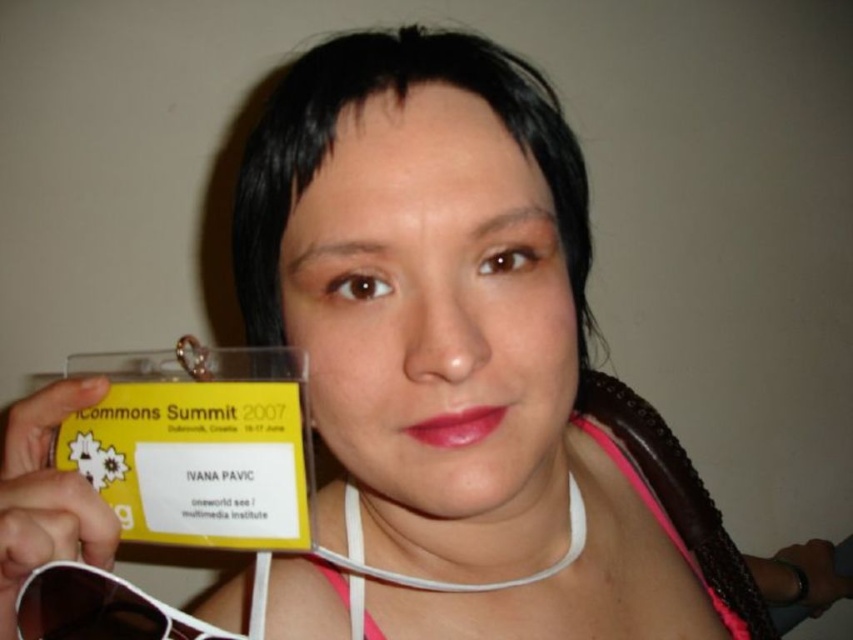
You are a photographer at the iCommons Summit 2007 event. You need to adjust the camera focus to capture both the black plastic sunglasses at lower left and the pink fabric bikini top at lower center clearly. Which object should you focus on first to ensure both are in focus, considering their sizes?

The black plastic sunglasses at lower left is shorter than the pink fabric bikini top at lower center. To ensure both are in focus, you should focus on the pink fabric bikini top at lower center first since it is larger and requires more detailed capture.

You are organizing a photo shoot and need to ensure that the black plastic sunglasses at lower left are positioned precisely. According to the coordinates provided, where exactly should the sunglasses be placed relative to the image frame?

The black plastic sunglasses at lower left should be positioned at coordinates point (99,609) relative to the image frame.

You are a photographer setting up for an event. You notice the black plastic sunglasses at lower left and the pink fabric bikini top at lower center in the scene. Based on their positions, which object is closer to the bottom edge of the image?

The black plastic sunglasses at lower left is closer to the bottom edge of the image because it is positioned below the pink fabric bikini top at lower center.